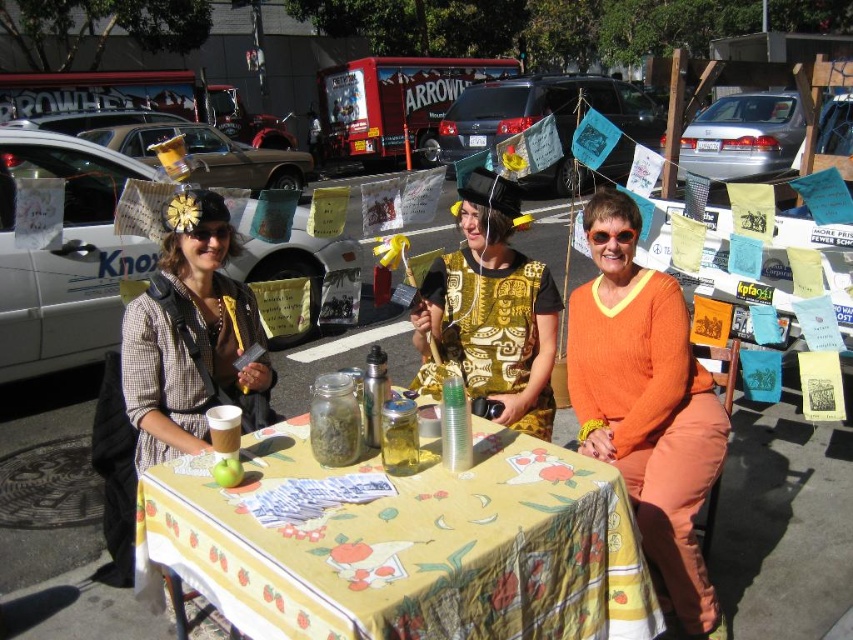
Looking at this image, is orange ribbed sweater at center to the right of matte plastic cup at table center from the viewer's perspective?

Yes, orange ribbed sweater at center is to the right of matte plastic cup at table center.

Based on the photo, can you confirm if orange ribbed sweater at center is wider than matte plastic cup at table center?

Indeed, orange ribbed sweater at center has a greater width compared to matte plastic cup at table center.

Where is `orange ribbed sweater at center`? Image resolution: width=853 pixels, height=640 pixels. orange ribbed sweater at center is located at coordinates (647, 406).

Is clear glass jar at table center wider than matte plastic cup at table center?

Indeed, clear glass jar at table center has a greater width compared to matte plastic cup at table center.

Describe the element at coordinates (334, 420) in the screenshot. I see `clear glass jar at table center` at that location.

Find the location of a particular element. clear glass jar at table center is located at coordinates (334, 420).

Image resolution: width=853 pixels, height=640 pixels. I want to click on orange ribbed sweater at center, so click(647, 406).

Measure the distance between point (607, 444) and camera.

Point (607, 444) is 2.31 meters away from camera.

Where is `orange ribbed sweater at center`? orange ribbed sweater at center is located at coordinates (647, 406).